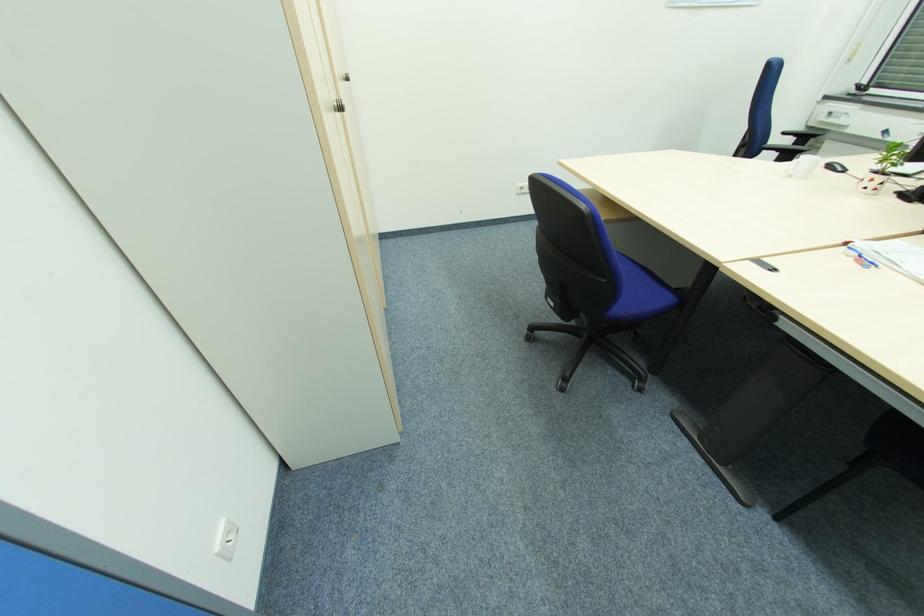
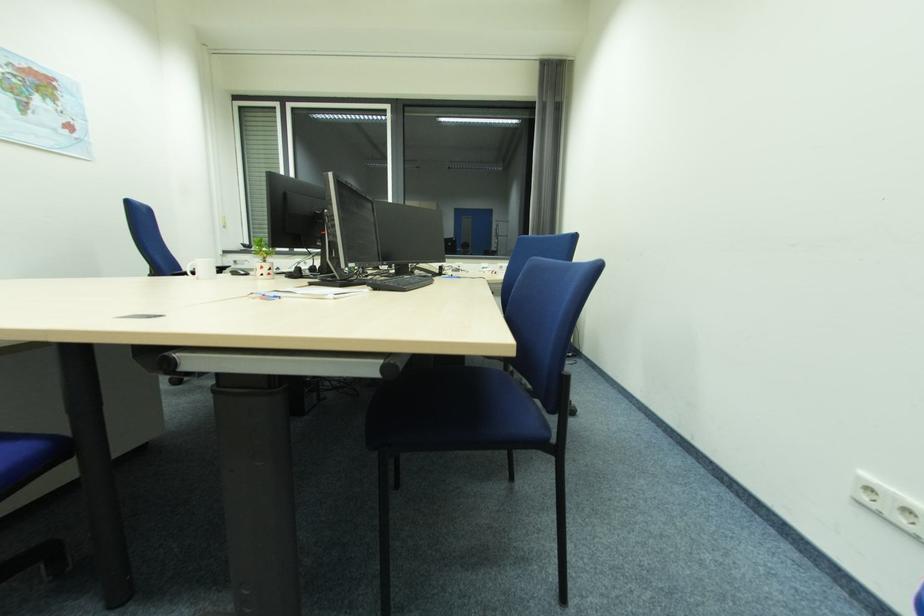
Question: The first image is from the beginning of the video and the second image is from the end. How did the camera likely rotate when shooting the video?

Choices:
 (A) Left
 (B) Right
 (C) Up
 (D) Down

Answer: (B)